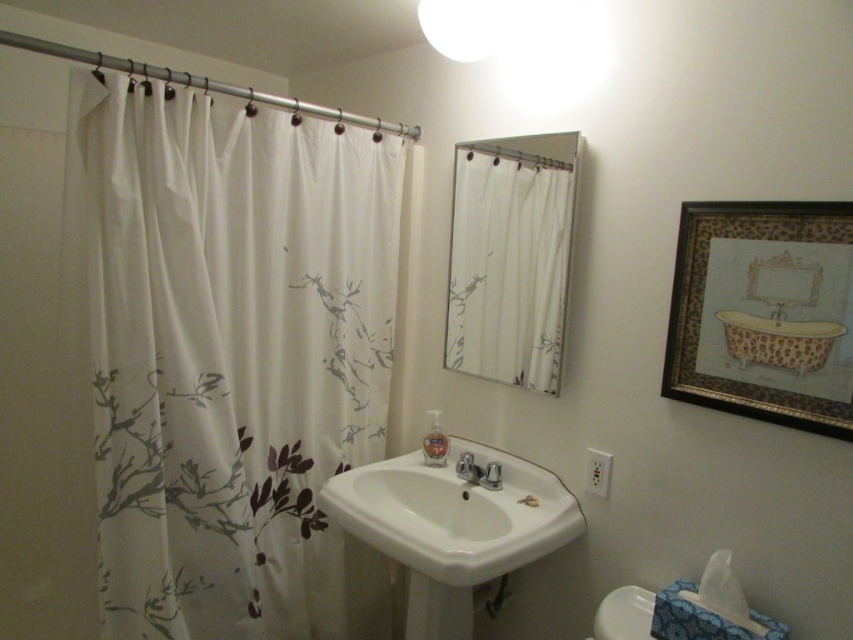
You are standing in the bathroom and need to reach the white glossy toilet bowl at lower right. The white fabric shower curtain at left is in your way. Can you walk around the shower curtain to access the toilet bowl?

The white glossy toilet bowl at lower right is behind the white fabric shower curtain at left, so you can walk around the shower curtain to access the toilet bowl.

In the scene shown: You are standing in the bathroom and see two points marked in the image. Which point is closer to you, point (271, 326) or point (511, 516)?

Point (271, 326) is closer to you than point (511, 516) because it is further to the viewer.